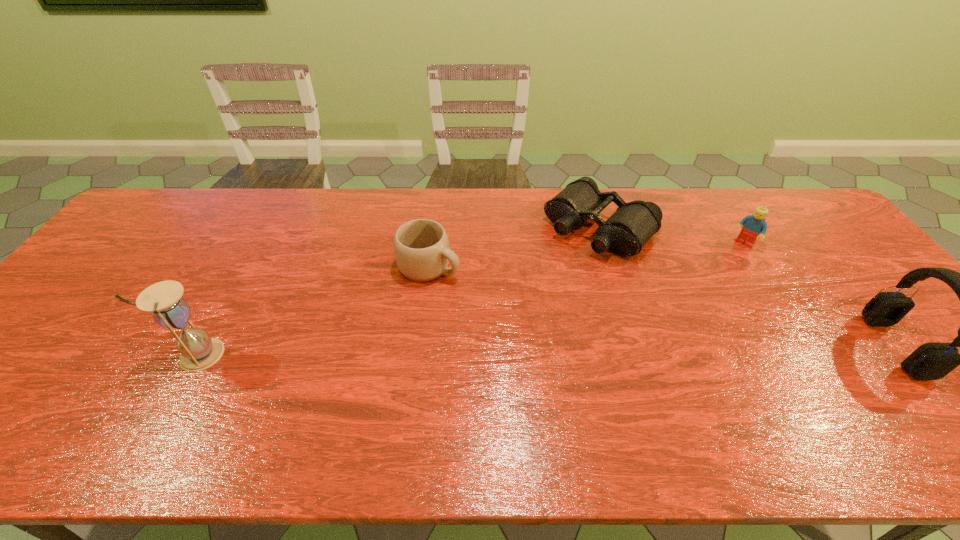
Find the location of `vacant spot on the desktop that is between the leftmost object and the rightmost object and is positioned through the eyepieces of the third object from left to right`. vacant spot on the desktop that is between the leftmost object and the rightmost object and is positioned through the eyepieces of the third object from left to right is located at coordinates (473, 351).

At what (x,y) coordinates should I click in order to perform the action: click on free space on the desktop that is between the leftmost object and the headset and is positioned on the side of the mug with the handle. Please return your answer as a coordinate pair (x, y). Looking at the image, I should click on (619, 349).

Where is `free space on the desktop that is between the hourglass and the headset and is positioned on the face of the second object from right to left`? free space on the desktop that is between the hourglass and the headset and is positioned on the face of the second object from right to left is located at coordinates (651, 349).